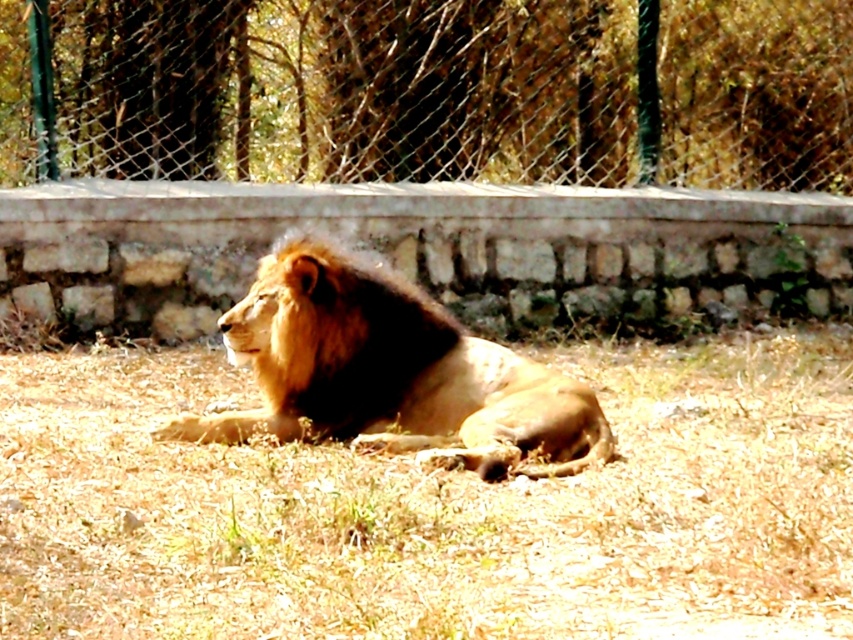
Question: Is brown dry grass at center positioned before wire mesh fence at center?

Choices:
 (A) yes
 (B) no

Answer: (A)

Question: Is brown dry grass at center to the left of brown fuzzy mane at center from the viewer's perspective?

Choices:
 (A) no
 (B) yes

Answer: (A)

Question: Which object is farther from the camera taking this photo?

Choices:
 (A) wire mesh fence at center
 (B) golden fur lion at center
 (C) brown dry grass at center
 (D) brown fuzzy mane at center

Answer: (A)

Question: Which of the following is the farthest from the observer?

Choices:
 (A) (230, 500)
 (B) (287, 360)
 (C) (241, 1)
 (D) (302, 292)

Answer: (C)

Question: Which point is closer to the camera?

Choices:
 (A) pos(345,266)
 (B) pos(288,356)
 (C) pos(621,529)

Answer: (C)

Question: Is brown dry grass at center wider than wire mesh fence at center?

Choices:
 (A) no
 (B) yes

Answer: (A)